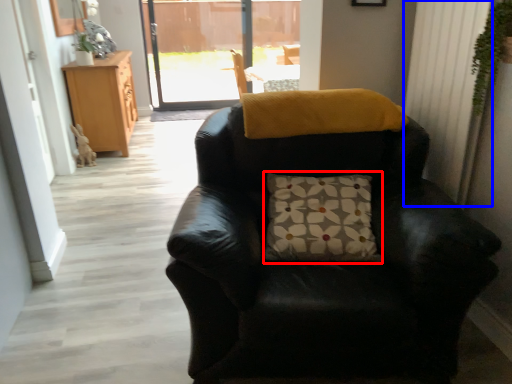
Question: Which object is further to the camera taking this photo, pillow (highlighted by a red box) or curtain (highlighted by a blue box)?

Choices:
 (A) pillow
 (B) curtain

Answer: (A)